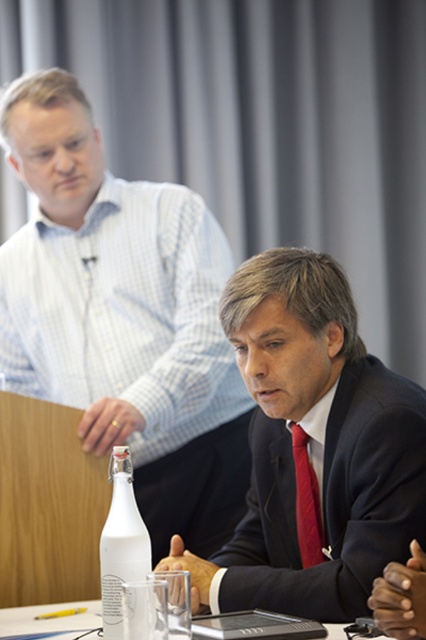
Is white glossy bottle at left shorter than red silk tie at center?

In fact, white glossy bottle at left may be taller than red silk tie at center.

Who is more distant from viewer, (81, 170) or (299, 484)?

Point (81, 170)

Does point (169, 253) lie in front of point (319, 544)?

That is False.

This screenshot has height=640, width=426. Identify the location of white glossy bottle at left. (123, 316).

Between white glass bottle at center and red silk tie at center, which one is positioned higher?

red silk tie at center is higher up.

Is the position of white glass bottle at center less distant than that of red silk tie at center?

Yes, white glass bottle at center is in front of red silk tie at center.

Is point (134, 568) in front of point (296, 476)?

Yes.

Locate an element on the screen. The image size is (426, 640). white glass bottle at center is located at coordinates (120, 541).

Does matte black suit at center come behind red silk tie at center?

No, it is not.

Does matte black suit at center have a greater width compared to red silk tie at center?

Yes, matte black suit at center is wider than red silk tie at center.

What do you see at coordinates (313, 449) in the screenshot? I see `matte black suit at center` at bounding box center [313, 449].

At what (x,y) coordinates should I click in order to perform the action: click on matte black suit at center. Please return your answer as a coordinate pair (x, y). Looking at the image, I should click on (313, 449).